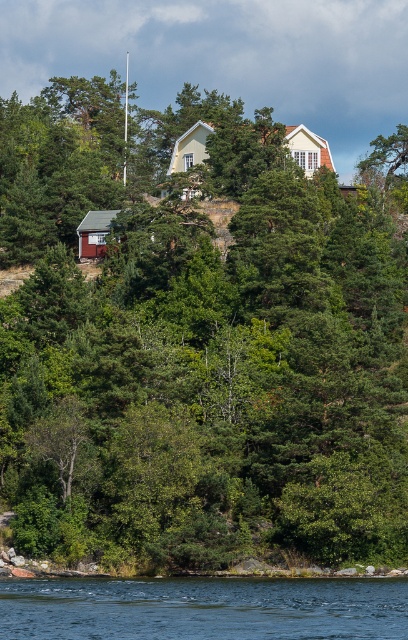
You are standing at the viewpoint of the image and see two points marked in the scene. Which point is closer to you, point [326,582] or point [310,161]?

Point [326,582] is in front of point [310,161], so it is closer to you.

You are standing at the center of the image and want to reach the transparent blue water at lower center. Which direction should you move in to get there?

You should move downward from the center of the image to reach the transparent blue water at lower center.